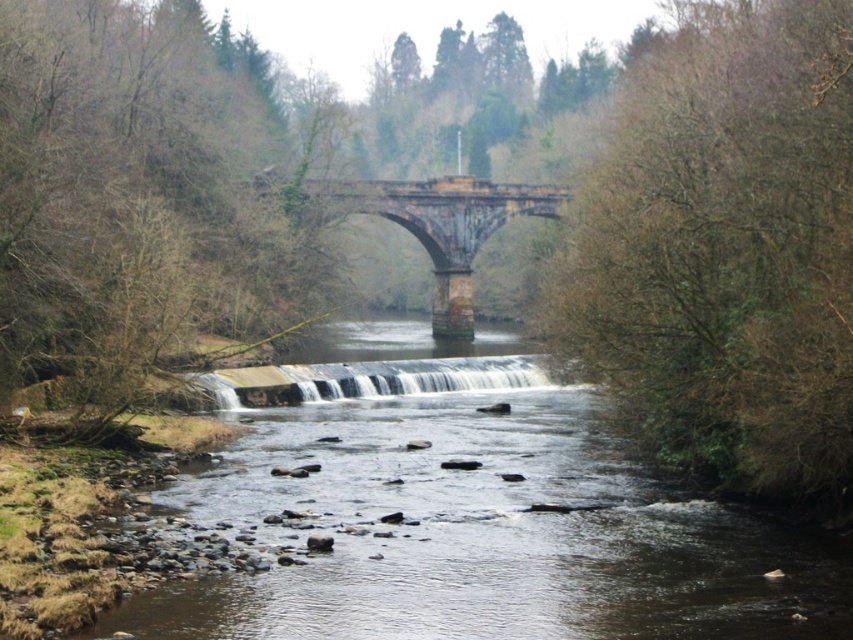
You are a photographer standing at the edge of the river. You want to capture a closeup shot of the bare branches at right. Given that your camera has a maximum zoom range of 50 feet, will you be able to get a clear closeup without moving closer?

The bare branches at right are 65.41 feet away from the camera. Since your camera can only zoom up to 50 feet, you won that be able to get a clear closeup without moving closer.